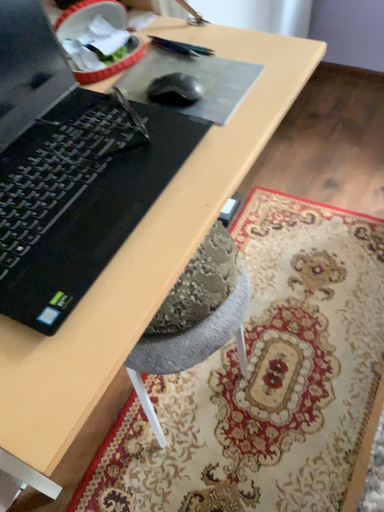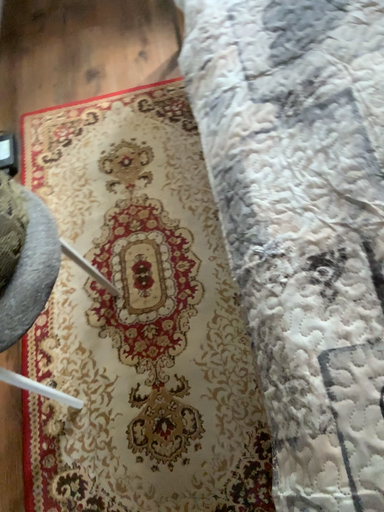
Question: Which way did the camera rotate in the video?

Choices:
 (A) rotated right
 (B) rotated left

Answer: (A)